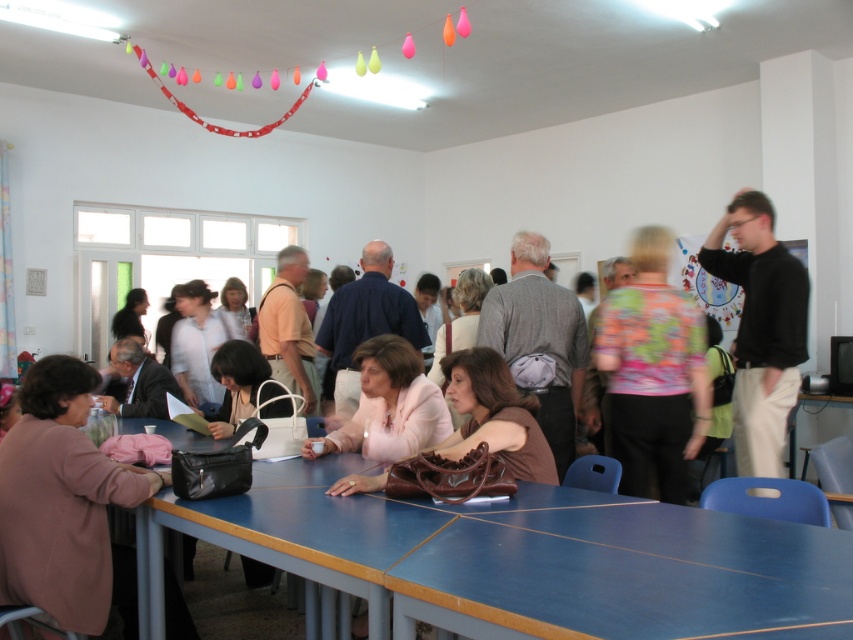
Identify the location of blue wooden table at lower center. Image resolution: width=853 pixels, height=640 pixels. (624, 573).

Is blue wooden table at lower center positioned before floral-patterned blouse at center?

Yes, it is in front of floral-patterned blouse at center.

Does point (775, 570) come farther from viewer compared to point (683, 483)?

No, it is not.

Find the location of `blue wooden table at lower center`. blue wooden table at lower center is located at coordinates (624, 573).

Does blue wooden table at lower center have a greater height compared to black cotton shirt at right?

In fact, blue wooden table at lower center may be shorter than black cotton shirt at right.

In the scene shown: Can you confirm if blue wooden table at lower center is positioned below black cotton shirt at right?

Yes, blue wooden table at lower center is below black cotton shirt at right.

Is point (750, 614) positioned behind point (728, 253)?

No, it is in front of (728, 253).

Where is `blue wooden table at lower center`? Image resolution: width=853 pixels, height=640 pixels. blue wooden table at lower center is located at coordinates (624, 573).

Between pink fabric purse at lower left and floral-patterned blouse at center, which one has more height?

floral-patterned blouse at center is taller.

Who is more distant from viewer, (x=74, y=538) or (x=671, y=413)?

The point (x=671, y=413) is behind.

Image resolution: width=853 pixels, height=640 pixels. In order to click on pink fabric purse at lower left in this screenshot , I will do `click(61, 499)`.